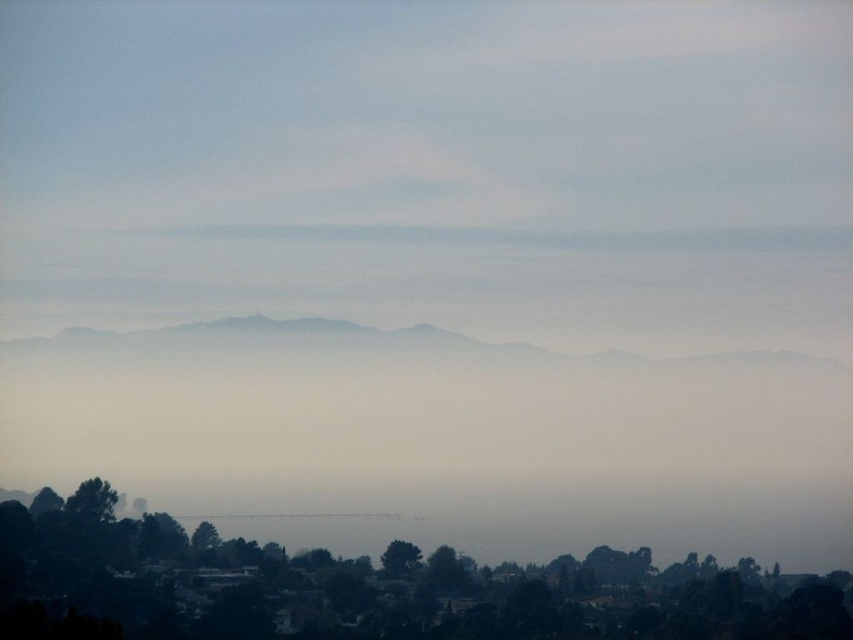
Question: Which point is farther to the camera?

Choices:
 (A) (403, 570)
 (B) (224, 609)

Answer: (B)

Question: Which point is farther to the camera?

Choices:
 (A) green matte tree at lower center
 (B) green matte tree at center

Answer: (A)

Question: In this image, where is green matte tree at lower center located relative to green matte tree at center?

Choices:
 (A) right
 (B) left

Answer: (A)

Question: Does green matte tree at lower center have a lesser width compared to green matte tree at center?

Choices:
 (A) yes
 (B) no

Answer: (B)

Question: Is green matte tree at lower center smaller than green matte tree at center?

Choices:
 (A) yes
 (B) no

Answer: (B)

Question: Among these points, which one is farthest from the camera?

Choices:
 (A) (x=397, y=557)
 (B) (x=19, y=536)

Answer: (B)